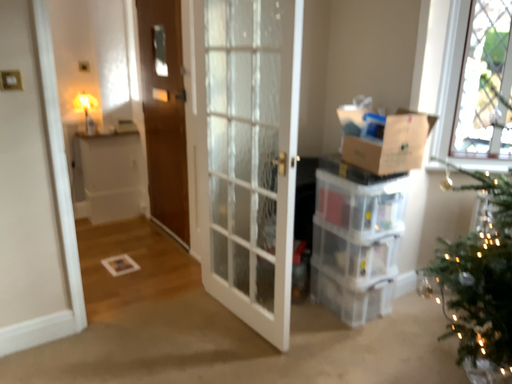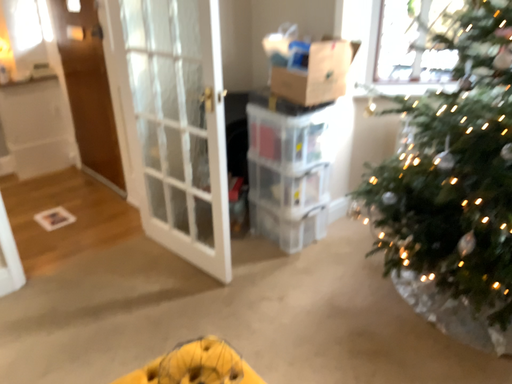
Question: How did the camera likely rotate when shooting the video?

Choices:
 (A) rotated right
 (B) rotated left

Answer: (A)